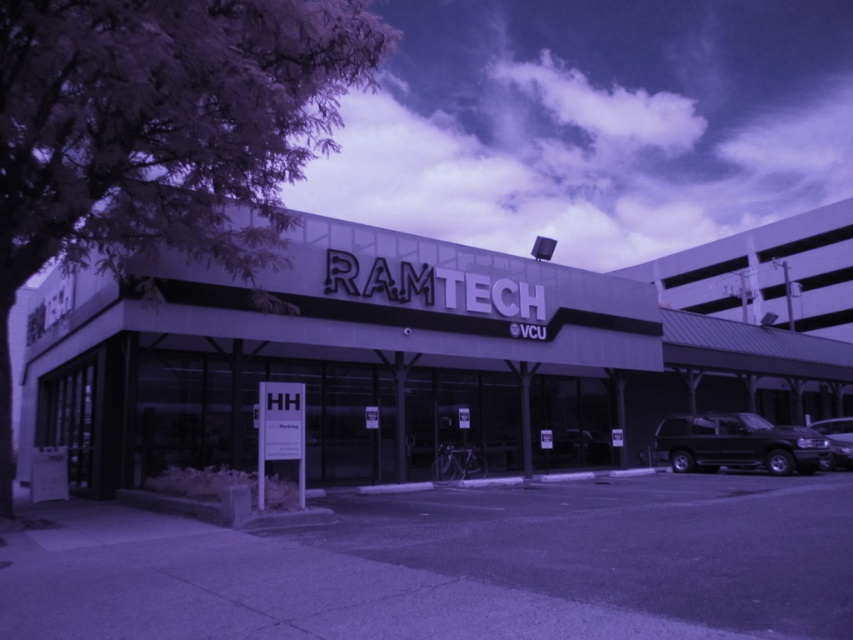
Question: Based on their relative distances, which object is nearer to the black matte van at lower right?

Choices:
 (A) white matte building at center
 (B) black matte suv at center

Answer: (B)

Question: Does white matte building at center appear under black matte suv at center?

Choices:
 (A) no
 (B) yes

Answer: (A)

Question: Which object appears closest to the camera in this image?

Choices:
 (A) white matte building at center
 (B) black matte van at lower right
 (C) black matte suv at center

Answer: (A)

Question: Does black matte suv at center appear on the right side of black matte van at lower right?

Choices:
 (A) yes
 (B) no

Answer: (B)

Question: Observing the image, what is the correct spatial positioning of white matte building at center in reference to black matte suv at center?

Choices:
 (A) right
 (B) left

Answer: (B)

Question: Among these points, which one is nearest to the camera?

Choices:
 (A) (572, 307)
 (B) (759, 442)
 (C) (849, 465)

Answer: (B)